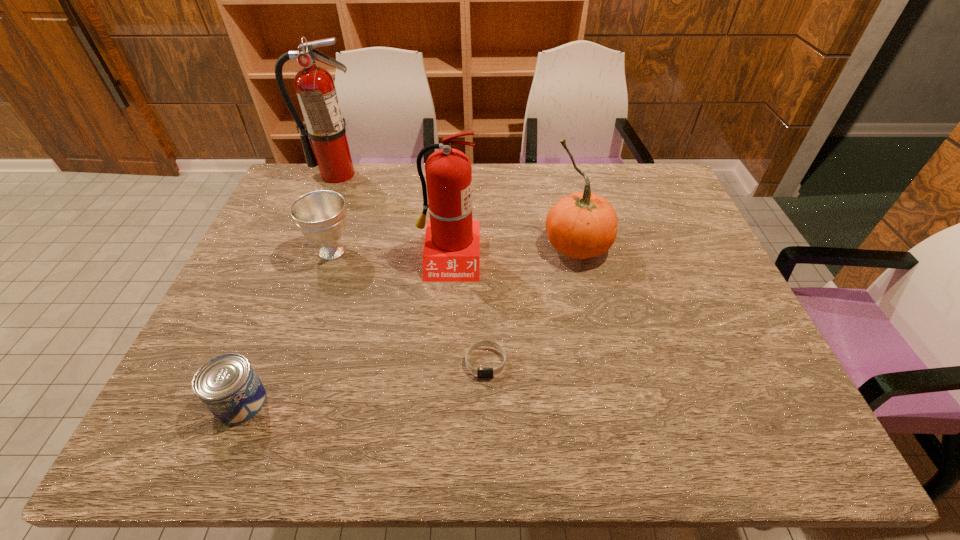
Where is `chalice that is at the left edge`? This screenshot has height=540, width=960. chalice that is at the left edge is located at coordinates (320, 215).

Identify the location of can located at the left edge. The height and width of the screenshot is (540, 960). (227, 385).

At what (x,y) coordinates should I click in order to perform the action: click on object at the far left corner. Please return your answer as a coordinate pair (x, y). Image resolution: width=960 pixels, height=540 pixels. Looking at the image, I should click on (315, 87).

The height and width of the screenshot is (540, 960). Identify the location of object present at the near left corner. (227, 385).

The height and width of the screenshot is (540, 960). Identify the location of vacant space at the far edge. 629,203.

Locate an element on the screen. vacant space at the near edge is located at coordinates (273, 424).

Locate an element on the screen. free space at the left edge of the desktop is located at coordinates (276, 315).

Find the location of a particular element. vacant space at the right edge is located at coordinates (686, 215).

What are the coordinates of `free space at the far right corner of the desktop` in the screenshot? It's located at (624, 171).

Image resolution: width=960 pixels, height=540 pixels. Find the location of `vacant space at the near right corner of the desktop`. vacant space at the near right corner of the desktop is located at coordinates (750, 439).